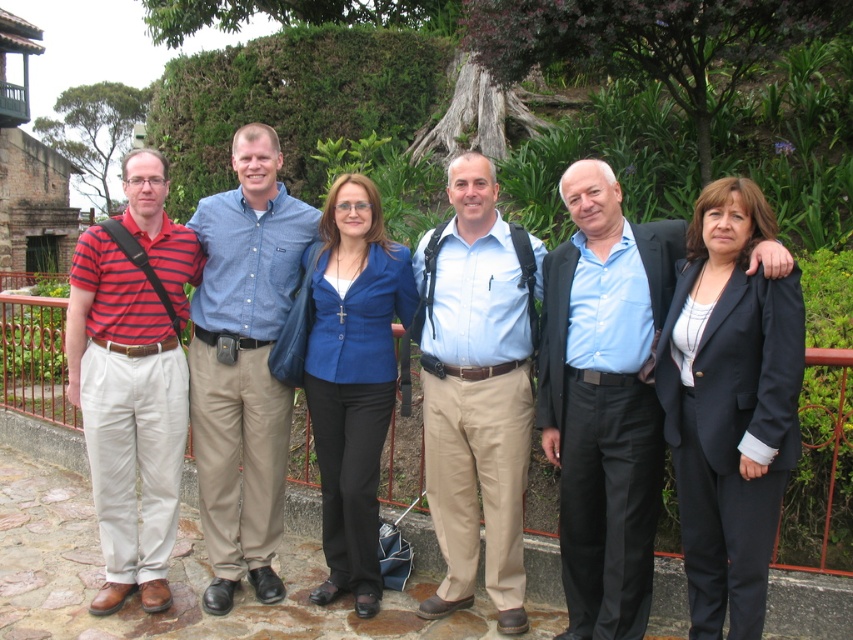
Question: Which point is farther to the camera?

Choices:
 (A) matte blue blazer at center
 (B) light blue shirt at center

Answer: (B)

Question: Among these objects, which one is nearest to the camera?

Choices:
 (A) matte blue blazer at center
 (B) blue denim shirt at center
 (C) striped cotton polo shirt at left
 (D) light blue shirt at center

Answer: (A)

Question: In this image, where is blue denim shirt at center located relative to striped cotton polo shirt at left?

Choices:
 (A) below
 (B) above

Answer: (A)

Question: Is blue shirt at center positioned before striped cotton polo shirt at left?

Choices:
 (A) yes
 (B) no

Answer: (A)

Question: Does matte blue blazer at center have a smaller size compared to blue denim shirt at center?

Choices:
 (A) no
 (B) yes

Answer: (A)

Question: Among these objects, which one is nearest to the camera?

Choices:
 (A) striped cotton polo shirt at left
 (B) blue denim shirt at center

Answer: (A)